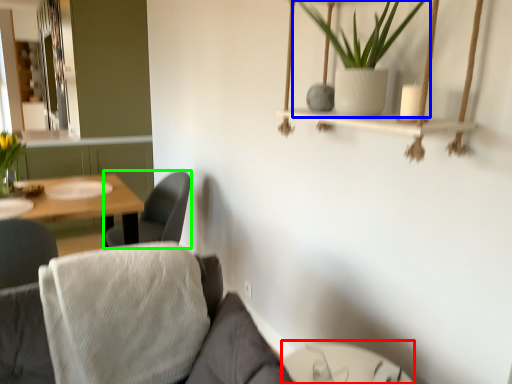
Question: Which object is the closest to the glass table (highlighted by a red box)? Choose among these: houseplant (highlighted by a blue box) or chair (highlighted by a green box).

Choices:
 (A) houseplant
 (B) chair

Answer: (A)